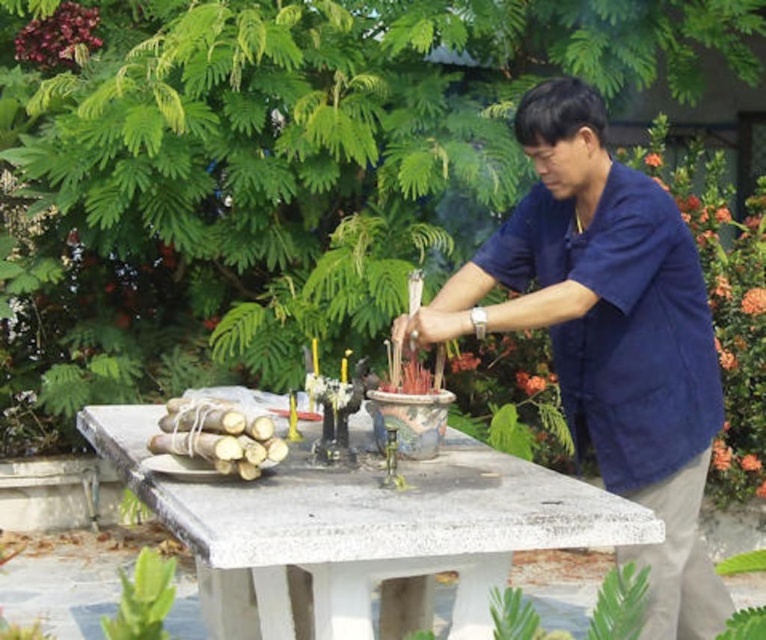
Question: Does blue cotton shirt at center appear over white concrete table at center?

Choices:
 (A) no
 (B) yes

Answer: (B)

Question: Which object is closer to the camera taking this photo?

Choices:
 (A) natural bamboo sticks at left
 (B) white concrete table at center
 (C) blue cotton shirt at center

Answer: (B)

Question: Can you confirm if blue cotton shirt at center is positioned below natural bamboo sticks at left?

Choices:
 (A) yes
 (B) no

Answer: (B)

Question: Which object is farther from the camera taking this photo?

Choices:
 (A) natural bamboo sticks at left
 (B) blue cotton shirt at center

Answer: (B)

Question: Among these objects, which one is farthest from the camera?

Choices:
 (A) white concrete table at center
 (B) blue cotton shirt at center
 (C) natural bamboo sticks at left

Answer: (B)

Question: Considering the relative positions of blue cotton shirt at center and natural bamboo sticks at left in the image provided, where is blue cotton shirt at center located with respect to natural bamboo sticks at left?

Choices:
 (A) below
 (B) above

Answer: (B)